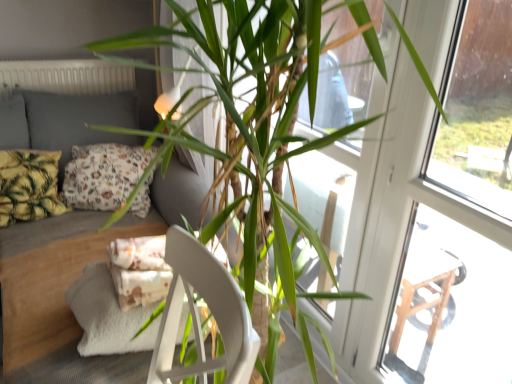
Question: Does floral fabric pillow at left, marked as the 2th pillow in a left-to-right arrangement, have a greater width compared to transparent glass screen door at upper right?

Choices:
 (A) no
 (B) yes

Answer: (B)

Question: From a real-world perspective, is floral fabric pillow at left, the first pillow viewed from the right, located beneath transparent glass screen door at upper right?

Choices:
 (A) yes
 (B) no

Answer: (A)

Question: Is the depth of floral fabric pillow at left, the first pillow viewed from the right, greater than that of transparent glass screen door at upper right?

Choices:
 (A) yes
 (B) no

Answer: (A)

Question: Does floral fabric pillow at left, the first pillow viewed from the right, have a lesser height compared to transparent glass screen door at upper right?

Choices:
 (A) no
 (B) yes

Answer: (B)

Question: From the image's perspective, is floral fabric pillow at left, marked as the 2th pillow in a left-to-right arrangement, on transparent glass screen door at upper right?

Choices:
 (A) no
 (B) yes

Answer: (B)

Question: Would you consider floral fabric pillow at left, the first pillow viewed from the right, to be distant from transparent glass screen door at upper right?

Choices:
 (A) no
 (B) yes

Answer: (B)

Question: Is transparent glass screen door at upper right next to yellow-green leafy fabric pillow at left, acting as the 1th pillow starting from the left, and touching it?

Choices:
 (A) yes
 (B) no

Answer: (B)

Question: Does transparent glass screen door at upper right have a lesser width compared to yellow-green leafy fabric pillow at left, acting as the 1th pillow starting from the left?

Choices:
 (A) yes
 (B) no

Answer: (A)

Question: Is transparent glass screen door at upper right in front of yellow-green leafy fabric pillow at left, positioned as the 2th pillow in right-to-left order?

Choices:
 (A) no
 (B) yes

Answer: (B)

Question: Could you tell me if transparent glass screen door at upper right is facing yellow-green leafy fabric pillow at left, positioned as the 2th pillow in right-to-left order?

Choices:
 (A) yes
 (B) no

Answer: (B)

Question: Is transparent glass screen door at upper right to the left of yellow-green leafy fabric pillow at left, acting as the 1th pillow starting from the left, from the viewer's perspective?

Choices:
 (A) no
 (B) yes

Answer: (A)

Question: Considering the relative sizes of transparent glass screen door at upper right and yellow-green leafy fabric pillow at left, positioned as the 2th pillow in right-to-left order, in the image provided, is transparent glass screen door at upper right taller than yellow-green leafy fabric pillow at left, positioned as the 2th pillow in right-to-left order,?

Choices:
 (A) no
 (B) yes

Answer: (B)

Question: Is transparent glass screen door at upper right surrounded by white matte radiator at upper left?

Choices:
 (A) yes
 (B) no

Answer: (B)